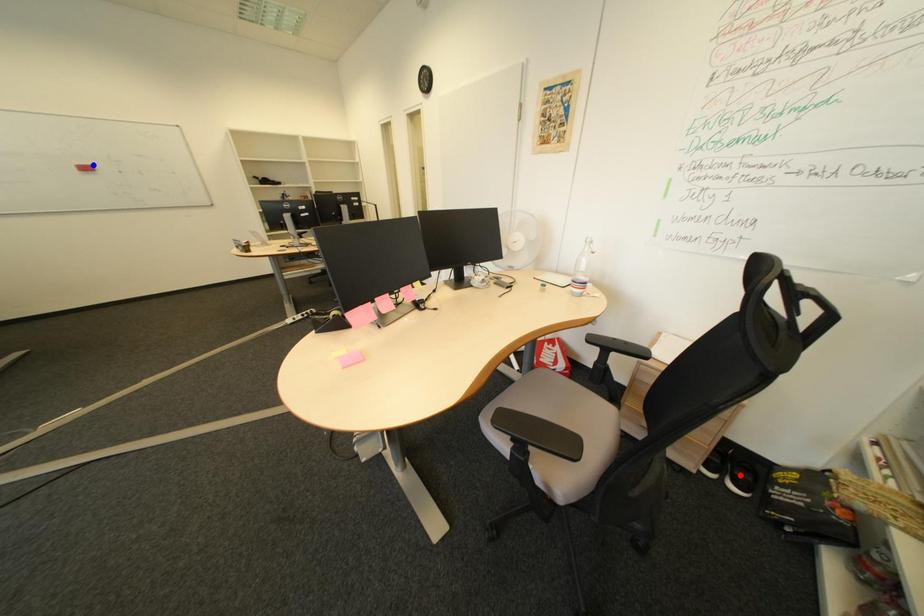
Question: Which of the two points in the image is closer to the camera?

Choices:
 (A) Blue point is closer.
 (B) Red point is closer.

Answer: (B)